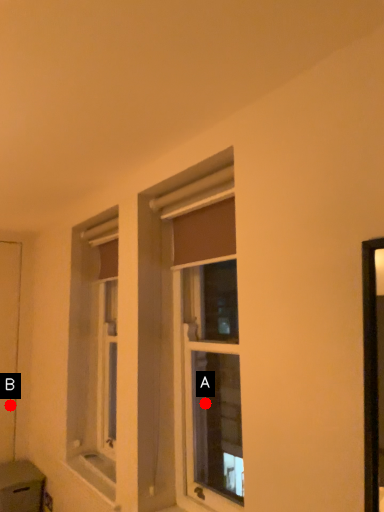
Question: Two points are circled on the image, labeled by A and B beside each circle. Which point is farther from the camera taking this photo?

Choices:
 (A) A is further
 (B) B is further

Answer: (B)